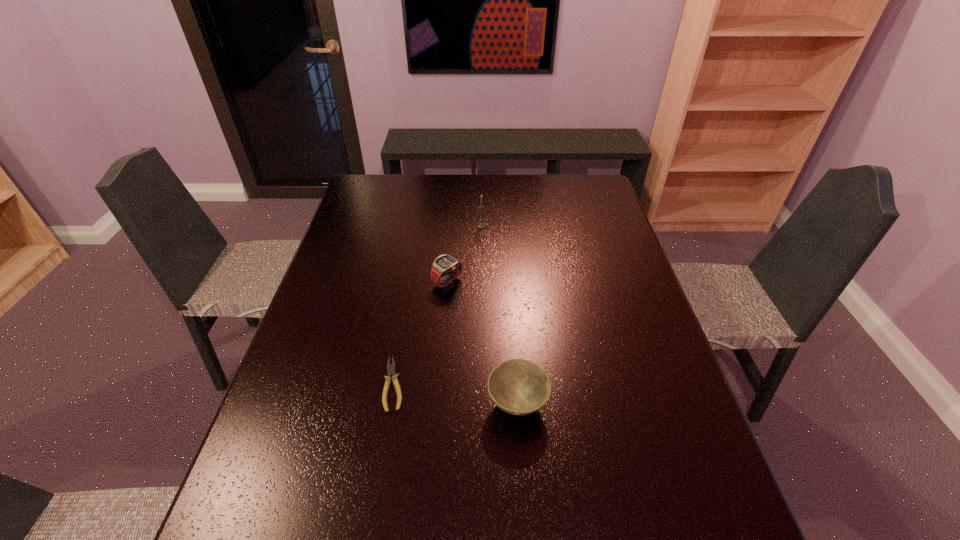
Where is `free point between the pliers and the third object from right to left`? This screenshot has height=540, width=960. free point between the pliers and the third object from right to left is located at coordinates (420, 333).

The image size is (960, 540). What are the coordinates of `free space between the tallest object and the bowl` in the screenshot? It's located at (499, 314).

In order to click on vacant area that lies between the bowl and the candle in this screenshot , I will do click(x=499, y=314).

Identify the location of empty space between the tallest object and the bowl. The image size is (960, 540). (499, 314).

In order to click on free point between the shortest object and the second farthest object in this screenshot , I will do `click(420, 333)`.

Identify the location of object that is the second closest one to the second object from left to right. The width and height of the screenshot is (960, 540). point(390,367).

Locate an element on the screen. The width and height of the screenshot is (960, 540). the closest object to the bowl is located at coordinates (390, 367).

The width and height of the screenshot is (960, 540). Identify the location of free space that satisfies the following two spatial constraints: 1. on the front side of the bowl; 2. on the left side of the shortest object. (391, 403).

This screenshot has height=540, width=960. In order to click on free point that satisfies the following two spatial constraints: 1. on the front side of the second object from left to right; 2. on the left side of the bowl in this screenshot , I will do `click(438, 403)`.

Locate an element on the screen. free location that satisfies the following two spatial constraints: 1. on the front side of the bowl; 2. on the right side of the shortest object is located at coordinates (391, 403).